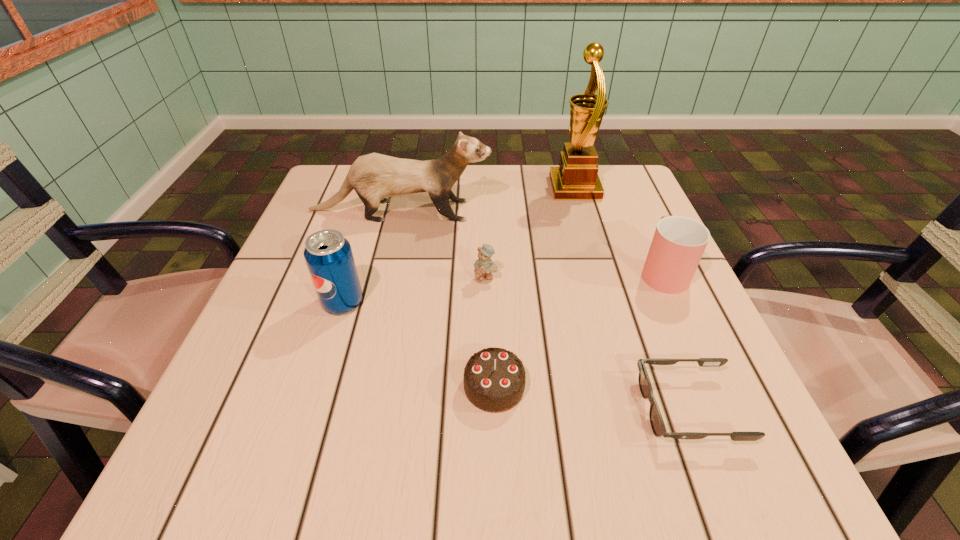
Where is `free space between the ferret and the shortest object`? The height and width of the screenshot is (540, 960). free space between the ferret and the shortest object is located at coordinates (544, 309).

The height and width of the screenshot is (540, 960). Identify the location of vacant region between the sunglasses and the sixth shortest object. (544, 309).

In order to click on free space that is in between the teddy bear and the tallest object in this screenshot , I will do `click(530, 233)`.

The image size is (960, 540). What are the coordinates of `empty location between the ferret and the chocolate cake` in the screenshot? It's located at (447, 299).

Find the location of `free space between the fourth shortest object and the ferret`. free space between the fourth shortest object and the ferret is located at coordinates (531, 241).

What are the coordinates of `vacant area that lies between the chocolate cake and the tallest object` in the screenshot? It's located at (535, 287).

Locate an element on the screen. The height and width of the screenshot is (540, 960). free space between the tallest object and the pop soda is located at coordinates 459,245.

Identify the location of the second closest object to the fourth shortest object. The height and width of the screenshot is (540, 960). (576, 178).

What are the coordinates of `object that is the sixth closest to the fourth tallest object` in the screenshot? It's located at (328, 254).

In order to click on free location that satisfies the following two spatial constraints: 1. on the face of the chocolate cake; 2. on the left side of the ferret in this screenshot , I will do `click(360, 386)`.